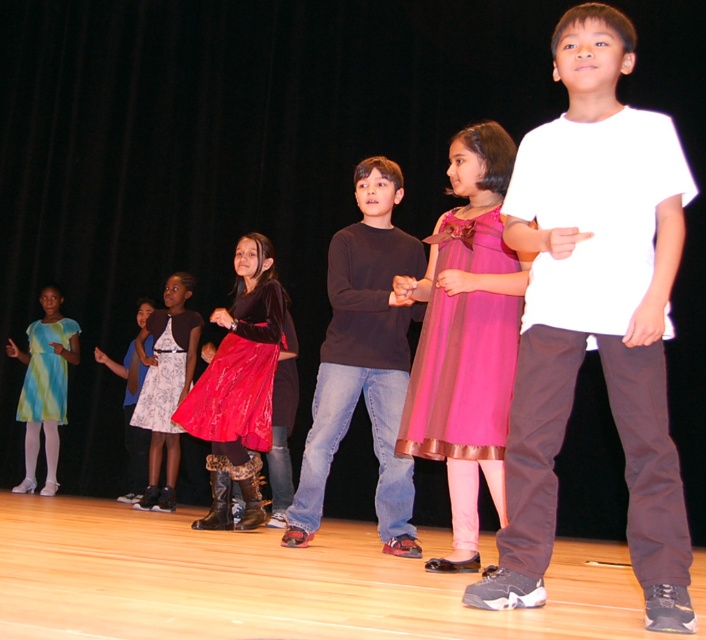
Question: Is dark gray sweater at center to the right of shiny red skirt at center from the viewer's perspective?

Choices:
 (A) yes
 (B) no

Answer: (A)

Question: Which of these objects is positioned farthest from the white satin dress at center?

Choices:
 (A) white cotton shirt at center
 (B) light blue satin dress at lower left
 (C) matte green dress at left
 (D) shiny red skirt at center

Answer: (A)

Question: Which object is closer to the camera taking this photo?

Choices:
 (A) matte green dress at left
 (B) white cotton shirt at center

Answer: (B)

Question: Is the position of dark gray sweater at center more distant than that of matte green dress at left?

Choices:
 (A) no
 (B) yes

Answer: (A)

Question: Among these objects, which one is nearest to the camera?

Choices:
 (A) white cotton shirt at center
 (B) dark gray sweater at center
 (C) light blue satin dress at lower left
 (D) matte green dress at left

Answer: (A)

Question: Does dark gray sweater at center have a lesser width compared to white satin dress at center?

Choices:
 (A) yes
 (B) no

Answer: (B)